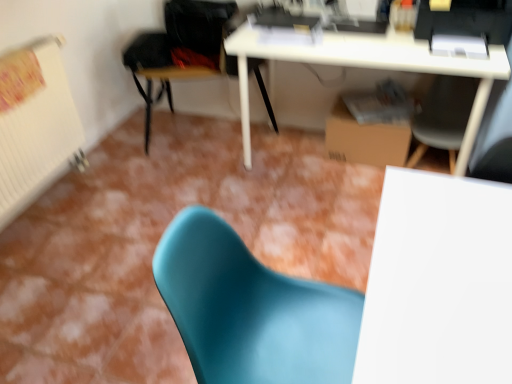
Where is `vacant space to the left of black leather chair at center, arranged as the third chair when viewed from the front`? The width and height of the screenshot is (512, 384). vacant space to the left of black leather chair at center, arranged as the third chair when viewed from the front is located at coordinates (111, 163).